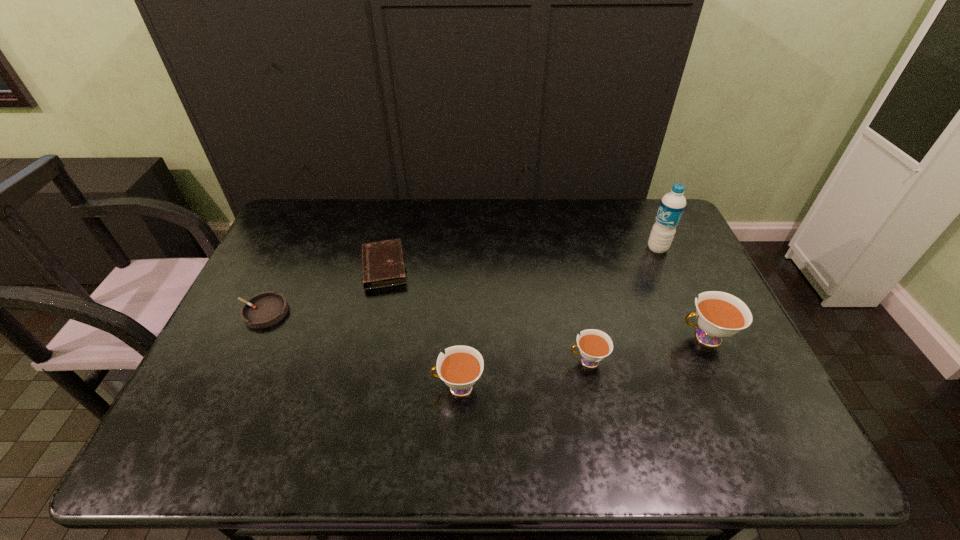
You are a GUI agent. You are given a task and a screenshot of the screen. Output one action in this format:
    pyautogui.click(x=<x>, y=<y>)
    Task: Click on the free region located on the side of the second shortest teacup with the handle
    Image resolution: width=960 pixels, height=540 pixels.
    Given the screenshot: What is the action you would take?
    (408, 387)

Identify the location of free space located on the side of the second shortest teacup with the handle. This screenshot has height=540, width=960. (284, 387).

This screenshot has height=540, width=960. What are the coordinates of `vacant space located 0.210m on the side of the second teacup from right to left with the handle` in the screenshot? It's located at (486, 361).

This screenshot has width=960, height=540. I want to click on free location located 0.050m on the side of the second teacup from right to left with the handle, so click(x=548, y=361).

You are a GUI agent. You are given a task and a screenshot of the screen. Output one action in this format:
    pyautogui.click(x=<x>, y=<y>)
    Task: Click on the vacant position located 0.370m on the side of the second teacup from right to left with the handle
    This screenshot has height=540, width=960.
    Given the screenshot: What is the action you would take?
    pyautogui.click(x=423, y=361)

What are the coordinates of `free space located 0.250m on the side of the tallest teacup with the handle` in the screenshot? It's located at (584, 338).

The width and height of the screenshot is (960, 540). I want to click on free location located on the side of the tallest teacup with the handle, so click(542, 338).

Identify the location of vacant region located on the side of the tallest teacup with the handle. (591, 338).

This screenshot has height=540, width=960. I want to click on free space located on the back of the fifth object from right to left, so click(x=394, y=225).

Find the location of `vacant area situated on the right of the ashtray`. vacant area situated on the right of the ashtray is located at coordinates (x=366, y=312).